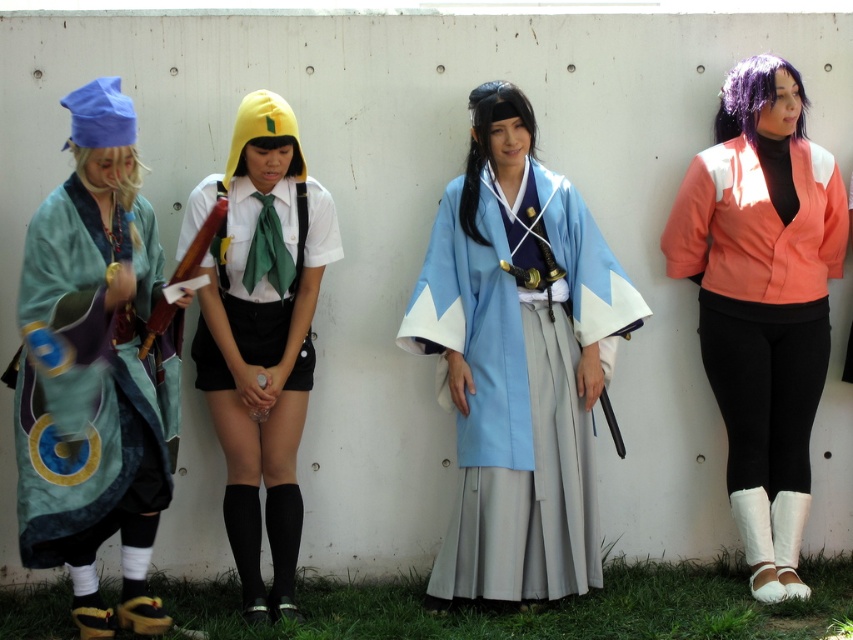
Who is positioned more to the left, orange fabric jacket at right or white matte uniform at center?

white matte uniform at center is more to the left.

Who is more distant from viewer, (735, 182) or (276, 148)?

Point (735, 182)

You are a GUI agent. You are given a task and a screenshot of the screen. Output one action in this format:
    pyautogui.click(x=<x>, y=<y>)
    Task: Click on the orange fabric jacket at right
    
    Given the screenshot: What is the action you would take?
    pyautogui.click(x=762, y=300)

Does point (74, 310) come closer to viewer compared to point (247, 465)?

Yes.

Who is more forward, (x=125, y=252) or (x=294, y=364)?

Point (x=125, y=252) is in front.

Who is more distant from viewer, (154, 525) or (201, 184)?

The point (201, 184) is more distant.

Where is `teal silk kimono at left`? Image resolution: width=853 pixels, height=640 pixels. teal silk kimono at left is located at coordinates (94, 371).

Does point (548, 339) lie behind point (85, 136)?

Yes.

Between light blue silk kimono at center and teal silk kimono at left, which one appears on the right side from the viewer's perspective?

light blue silk kimono at center

This screenshot has height=640, width=853. What are the coordinates of `light blue silk kimono at center` in the screenshot? It's located at (518, 360).